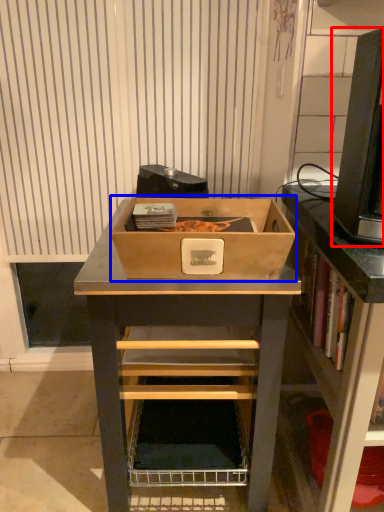
Question: Which object appears farthest to the camera in this image, desktop computer (highlighted by a red box) or box (highlighted by a blue box)?

Choices:
 (A) desktop computer
 (B) box

Answer: (B)